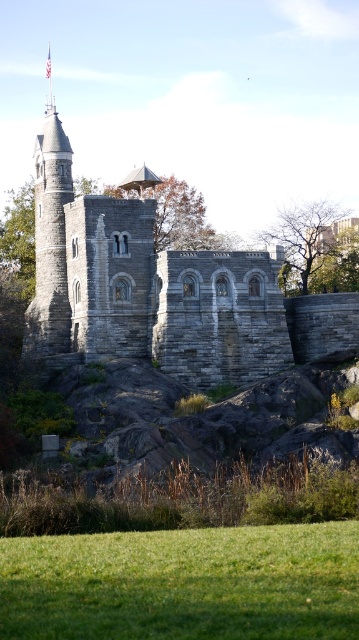
Question: Can you confirm if green grassy field at lower center is wider than gray stone tower at left?

Choices:
 (A) yes
 (B) no

Answer: (A)

Question: Considering the relative positions of green grassy field at lower center and gray stone tower at left in the image provided, where is green grassy field at lower center located with respect to gray stone tower at left?

Choices:
 (A) below
 (B) above

Answer: (A)

Question: Among these points, which one is farthest from the camera?

Choices:
 (A) (59, 312)
 (B) (40, 609)

Answer: (A)

Question: Where is green grassy field at lower center located in relation to gray stone tower at left in the image?

Choices:
 (A) left
 (B) right

Answer: (B)